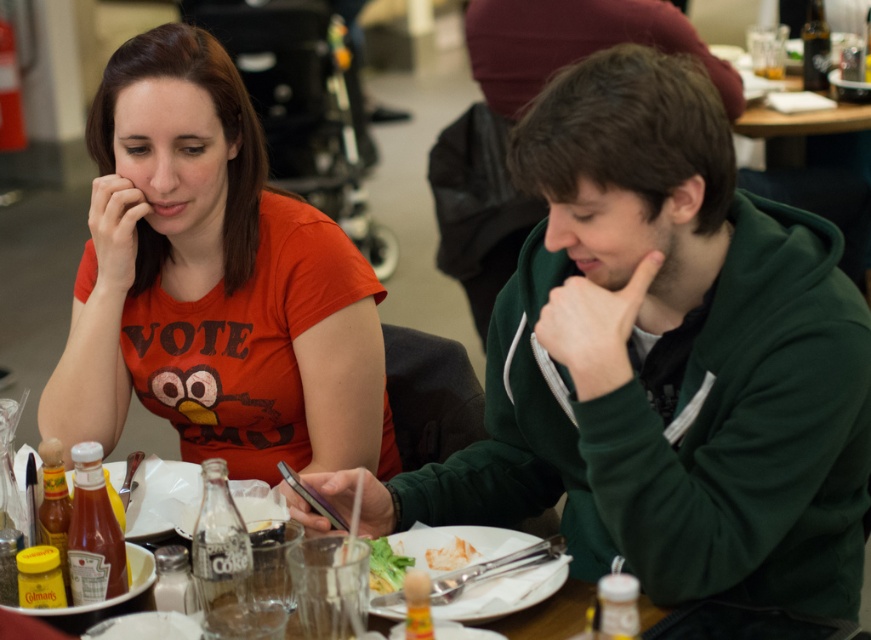
Question: Does matte orange t-shirt at upper left have a greater width compared to white crispy bread at plate center?

Choices:
 (A) yes
 (B) no

Answer: (A)

Question: Which object is positioned closest to the green fleece jacket at center?

Choices:
 (A) matte orange t-shirt at upper left
 (B) white crispy bread at plate center
 (C) wooden table at center

Answer: (B)

Question: Observing the image, what is the correct spatial positioning of green fleece jacket at center in reference to wooden table at center?

Choices:
 (A) below
 (B) above

Answer: (B)

Question: Which point is closer to the camera taking this photo?

Choices:
 (A) (795, 516)
 (B) (397, 557)
 (C) (28, 520)
 (D) (145, 376)

Answer: (A)

Question: Which of the following is the farthest from the observer?

Choices:
 (A) white crispy bread at plate center
 (B) matte orange t-shirt at upper left
 (C) green leafy salad at center
 (D) wooden table at center

Answer: (B)

Question: Can you confirm if matte orange t-shirt at upper left is positioned above wooden table at center?

Choices:
 (A) no
 (B) yes

Answer: (B)